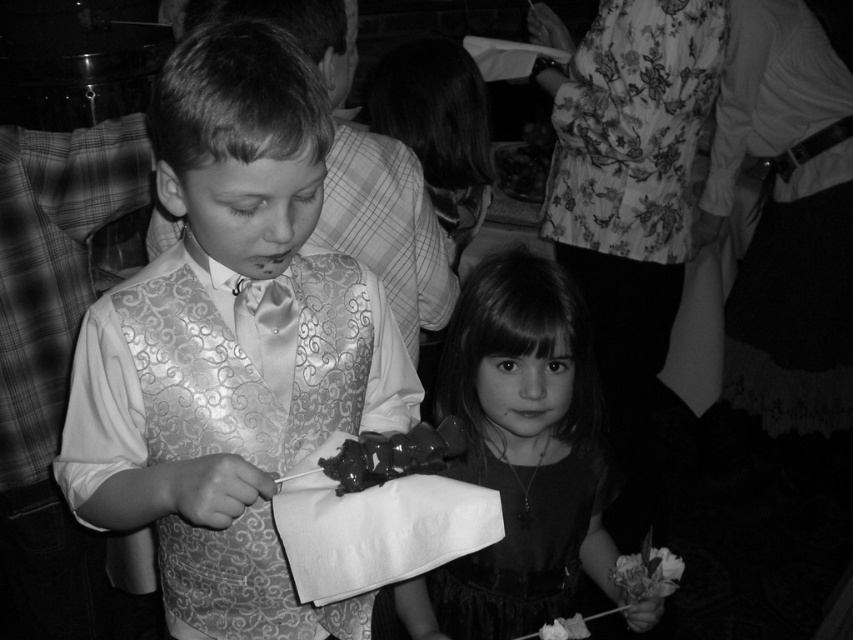
You are a photographer at a wedding reception. You need to determine if the satin vest at left can fit into a storage box that is the same size as the shiny dark chocolate at lower center. Can it fit?

The satin vest at left is wider than the shiny dark chocolate at lower center, so it cannot fit into the storage box of the same size as the chocolate.

In the scene of the wedding reception, there are two items of interest. The first is the silky satin vest at center, and the second is the shiny dark chocolate at lower center. From the perspective of someone standing in front of the image, which item is positioned to the right?

The shiny dark chocolate at lower center is positioned to the right of the silky satin vest at center.

Based on the scene description, where is the satin vest at left located in the image?

The satin vest at left is located at point [231,346] in the image.